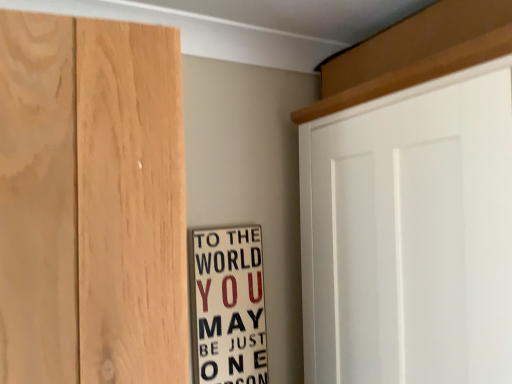
What is the approximate height of white paper sign at center?

The height of white paper sign at center is 14.89 inches.

This screenshot has height=384, width=512. In order to click on white paper sign at center in this screenshot , I will do `click(229, 306)`.

Image resolution: width=512 pixels, height=384 pixels. Describe the element at coordinates (229, 306) in the screenshot. I see `white paper sign at center` at that location.

Locate an element on the screen. white paper sign at center is located at coordinates (229, 306).